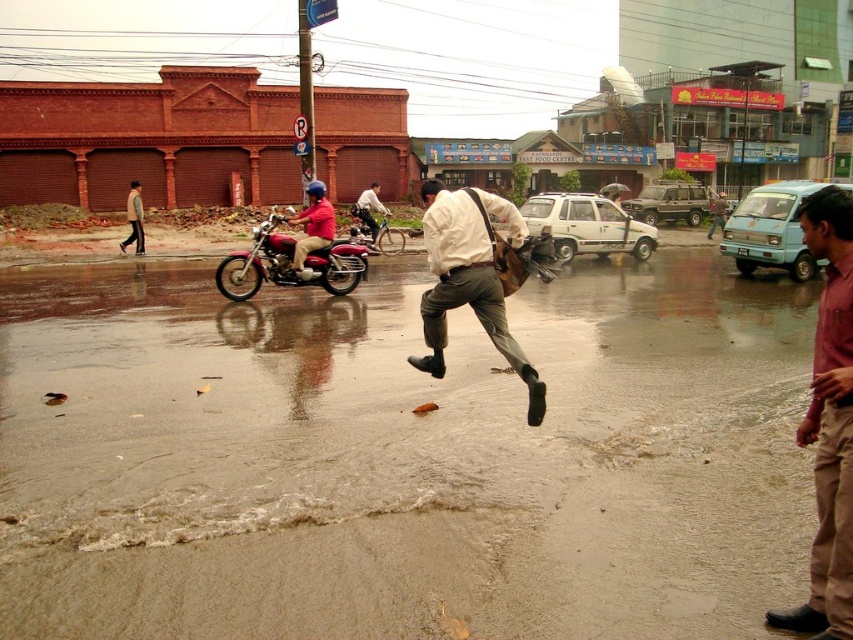
You are a pedestrian trying to cross the street. You see a brown cotton pants at right and a matte red motorcycle at center. Which object is closer to your right side?

The brown cotton pants at right is positioned on the right side of matte red motorcycle at center, so the brown cotton pants at right is closer to your right side.